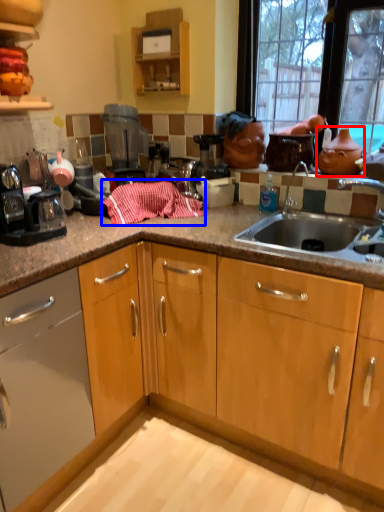
Question: Which object is closer to the camera taking this photo, tea pot (highlighted by a red box) or material (highlighted by a blue box)?

Choices:
 (A) tea pot
 (B) material

Answer: (B)